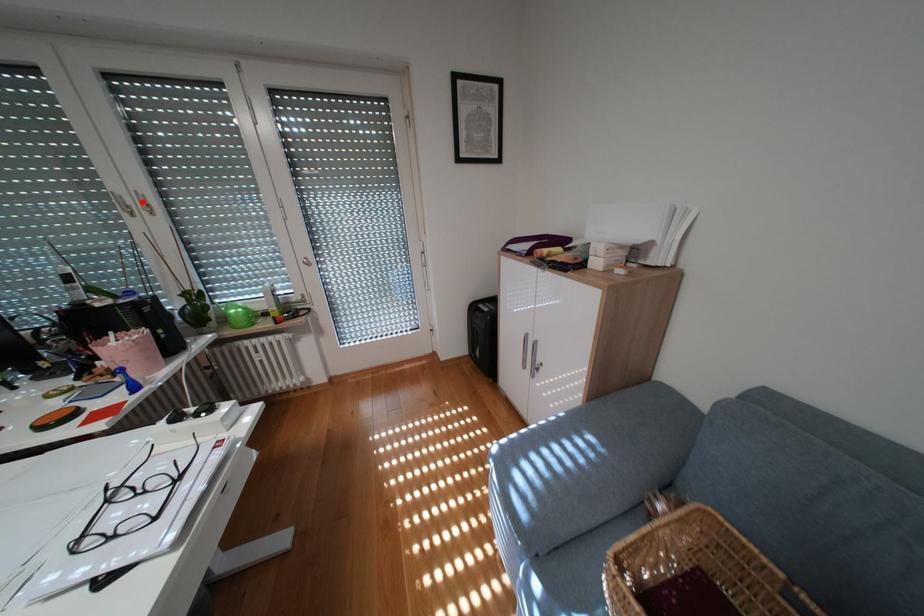
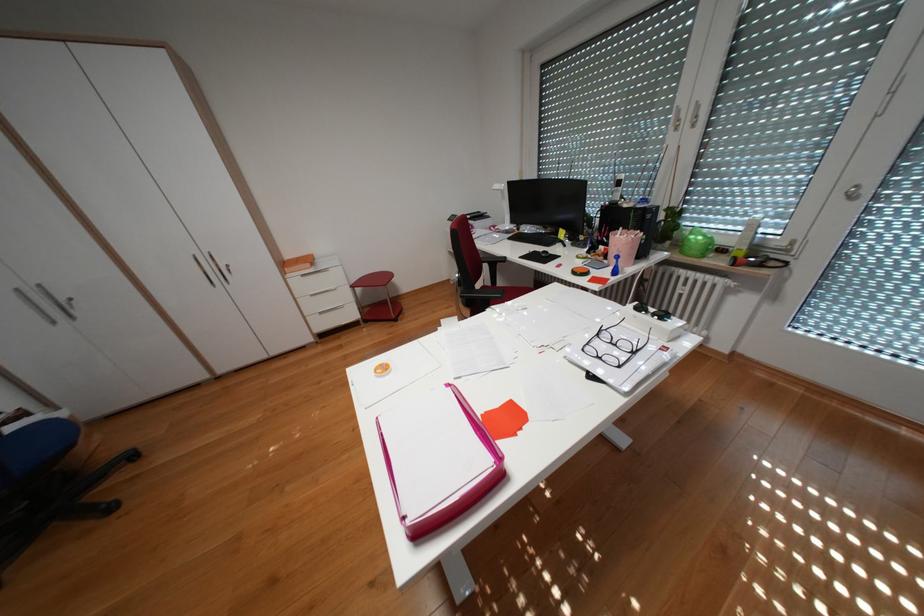
Locate, in the second image, the point that corresponds to the highlighted location in the first image.

(695, 116)